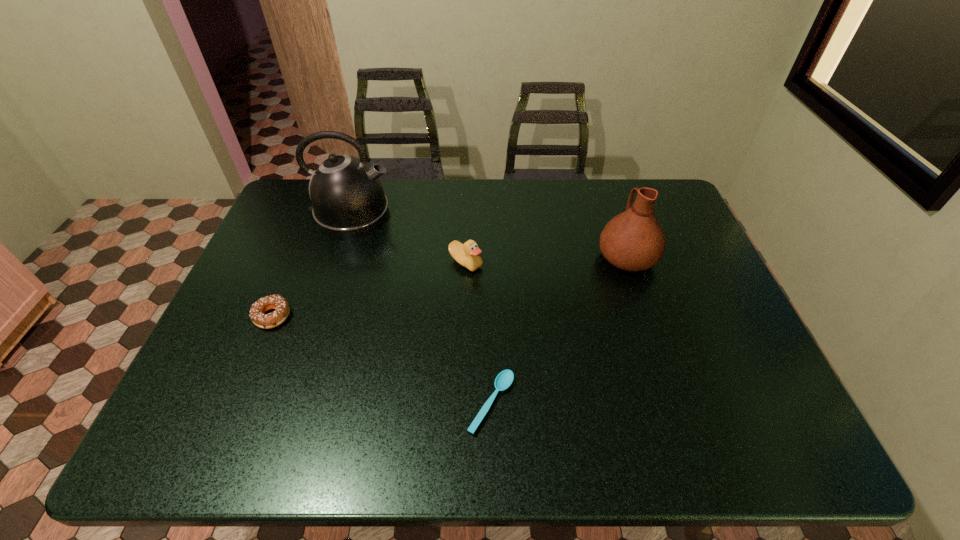
Identify the location of free spot that satisfies the following two spatial constraints: 1. on the front side of the doughnut; 2. on the left side of the nearest object. (236, 403).

You are a GUI agent. You are given a task and a screenshot of the screen. Output one action in this format:
    pyautogui.click(x=<x>, y=<y>)
    Task: Click on the vacant space that satisfies the following two spatial constraints: 1. at the beak of the spoon; 2. on the right side of the third shortest object
    This screenshot has height=540, width=960.
    Given the screenshot: What is the action you would take?
    pyautogui.click(x=462, y=403)

Identify the location of free space that satisfies the following two spatial constraints: 1. on the side of the rightmost object with the handle; 2. on the spout of the kettle. Image resolution: width=960 pixels, height=540 pixels. (612, 213).

This screenshot has width=960, height=540. Find the location of `free space that satisfies the following two spatial constraints: 1. on the side of the pitcher with the handle; 2. on the spout of the tallest object`. free space that satisfies the following two spatial constraints: 1. on the side of the pitcher with the handle; 2. on the spout of the tallest object is located at coordinates (612, 213).